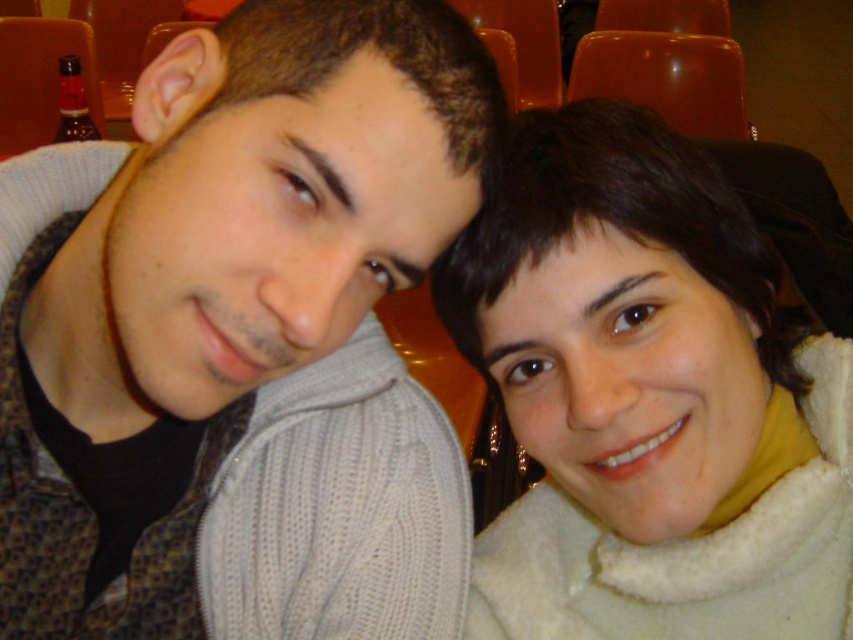
Between knitted sweater at center and white fleece scarf at upper right, which one appears on the right side from the viewer's perspective?

Positioned to the right is white fleece scarf at upper right.

Can you confirm if knitted sweater at center is positioned to the left of white fleece scarf at upper right?

Correct, you'll find knitted sweater at center to the left of white fleece scarf at upper right.

Find the location of `knitted sweater at center`. knitted sweater at center is located at coordinates (236, 333).